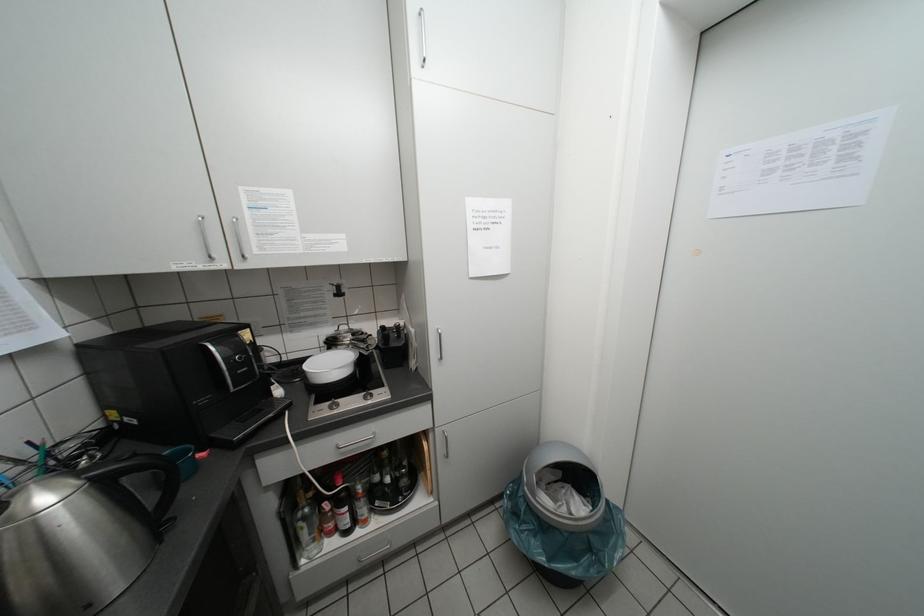
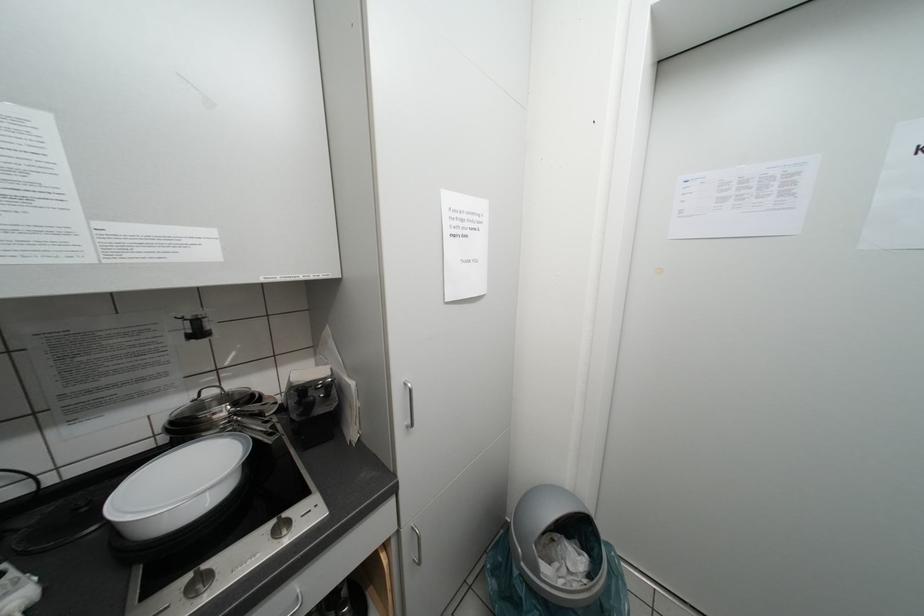
Question: The camera is either moving clockwise (left) or counter-clockwise (right) around the object. The first image is from the beginning of the video and the second image is from the end. Is the camera moving left or right when shooting the video?

Choices:
 (A) Left
 (B) Right

Answer: (A)